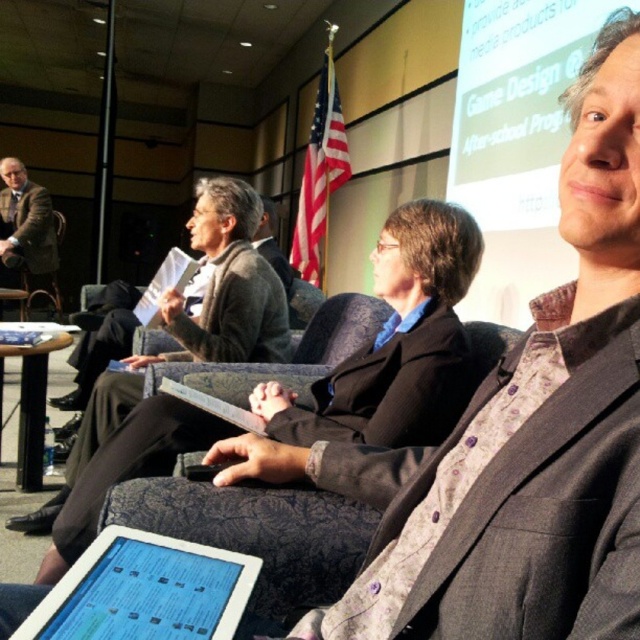
You are an event planner organizing a photoshoot in this conference room. You need to position a large backdrop behind the dark gray textured blazer at center and the matte brown suit at left. Based on their positions, which object should the backdrop be placed behind to cover both?

The backdrop should be placed behind the matte brown suit at left because the dark gray textured blazer at center is located below it, meaning the matte brown suit at left is further back and can be covered by the backdrop along with the blazer below it.

Looking at this image, you are a photographer standing in the conference room. You want to take a photo of the dark gray textured blazer at center without including any other people in the frame. Given your current position, is it possible to zoom in enough to capture only the blazer?

The dark gray textured blazer at center and viewer are 18.28 inches apart. Since the distance is relatively short, zooming in should allow you to focus solely on the blazer without including other people in the frame.

In the conference room scene, there are two people wearing dark gray suits. One is wearing a dark gray textured blazer at center, and the other is wearing a dark gray wool suit at center. Which of these two suits has a shorter length?

The dark gray textured blazer at center has a lesser height compared to the dark gray wool suit at center, so the dark gray textured blazer at center is shorter in length.